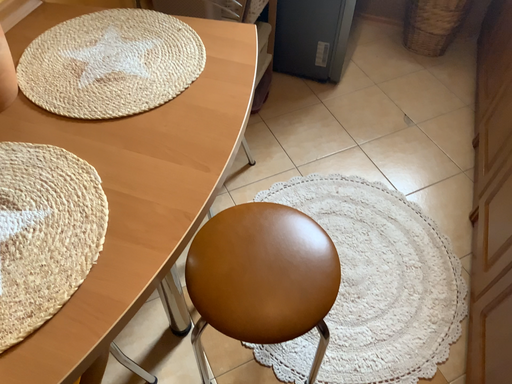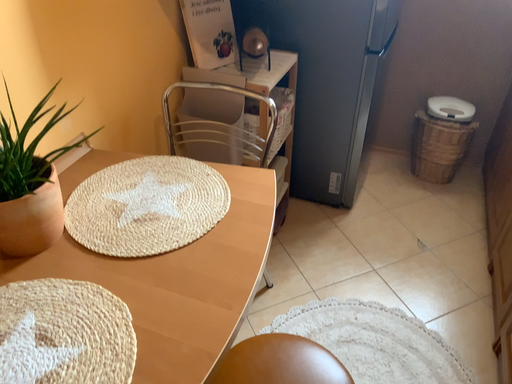
Question: Which way did the camera rotate in the video?

Choices:
 (A) rotated upward
 (B) rotated downward

Answer: (A)